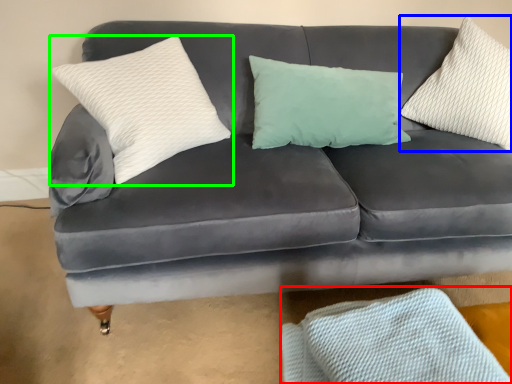
Question: Which object is the closest to the material (highlighted by a red box)? Choose among these: pillow (highlighted by a blue box) or pillow (highlighted by a green box).

Choices:
 (A) pillow
 (B) pillow

Answer: (B)